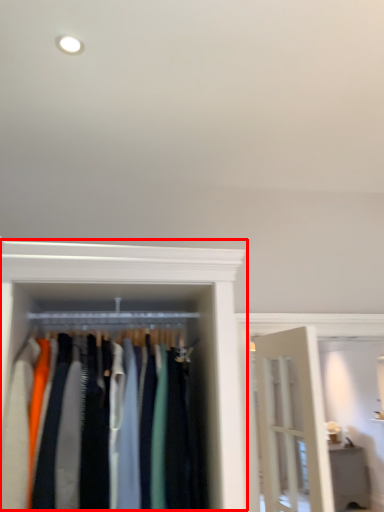
Question: Considering the relative positions of closet (annotated by the red box) and furniture in the image provided, where is closet (annotated by the red box) located with respect to the staircase?

Choices:
 (A) right
 (B) left

Answer: (B)